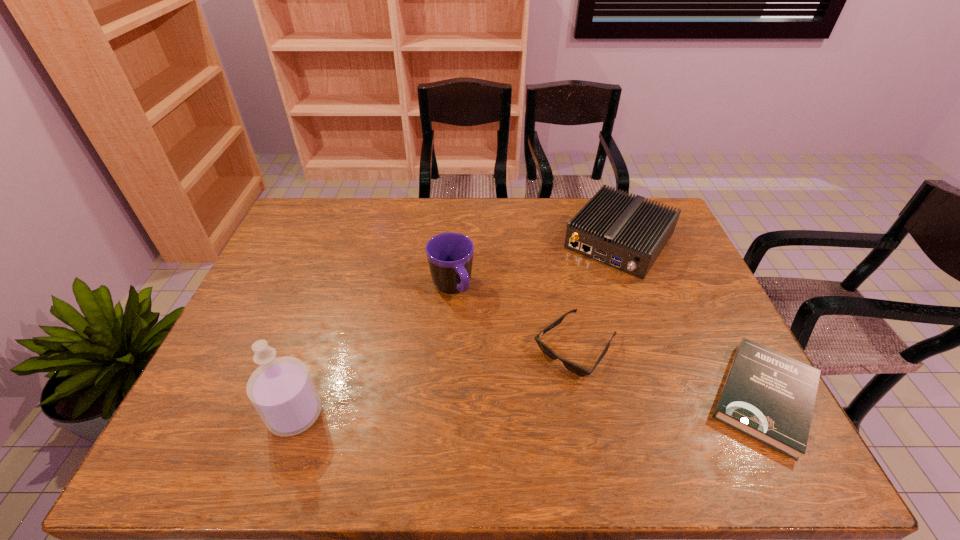
Locate an element on the screen. The image size is (960, 540). book that is at the near edge is located at coordinates (768, 396).

Find the location of a particular element. The width and height of the screenshot is (960, 540). book that is at the right edge is located at coordinates (768, 396).

The width and height of the screenshot is (960, 540). Find the location of `router that is at the right edge`. router that is at the right edge is located at coordinates (623, 231).

Locate an element on the screen. The height and width of the screenshot is (540, 960). object that is at the far right corner is located at coordinates (623, 231).

Identify the location of object present at the near right corner. Image resolution: width=960 pixels, height=540 pixels. (768, 396).

In the image, there is a desktop. Where is `vacant space at the far edge`? The image size is (960, 540). vacant space at the far edge is located at coordinates (x=556, y=236).

Image resolution: width=960 pixels, height=540 pixels. Identify the location of free space at the near edge of the desktop. (477, 404).

In the image, there is a desktop. Where is `vacant space at the left edge`? The height and width of the screenshot is (540, 960). vacant space at the left edge is located at coordinates (265, 316).

Find the location of `free space at the right edge of the desktop`. free space at the right edge of the desktop is located at coordinates (670, 247).

Where is `free spot between the sunglasses and the mug`? free spot between the sunglasses and the mug is located at coordinates (514, 319).